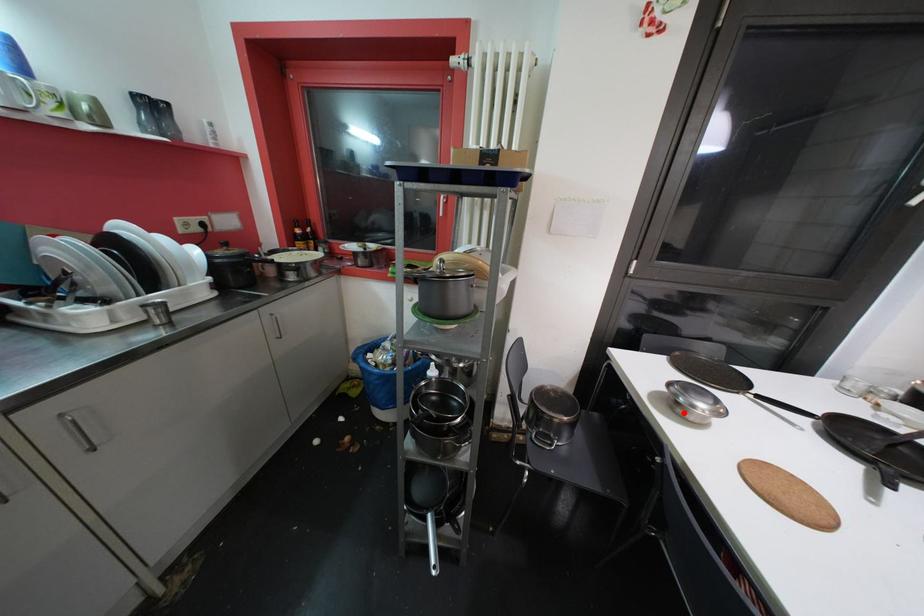
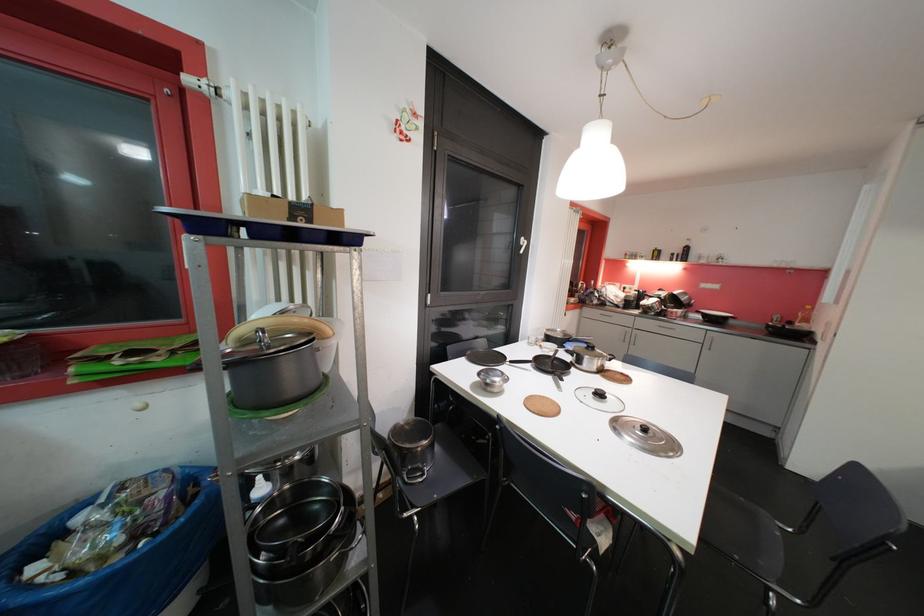
Question: I am providing you with two images of the same scene from different viewpoints. Image1 has a red point marked. In image2, the corresponding 3D location appears at what relative position? Reply with the corresponding letter.

Choices:
 (A) Closer
 (B) Farther

Answer: (B)